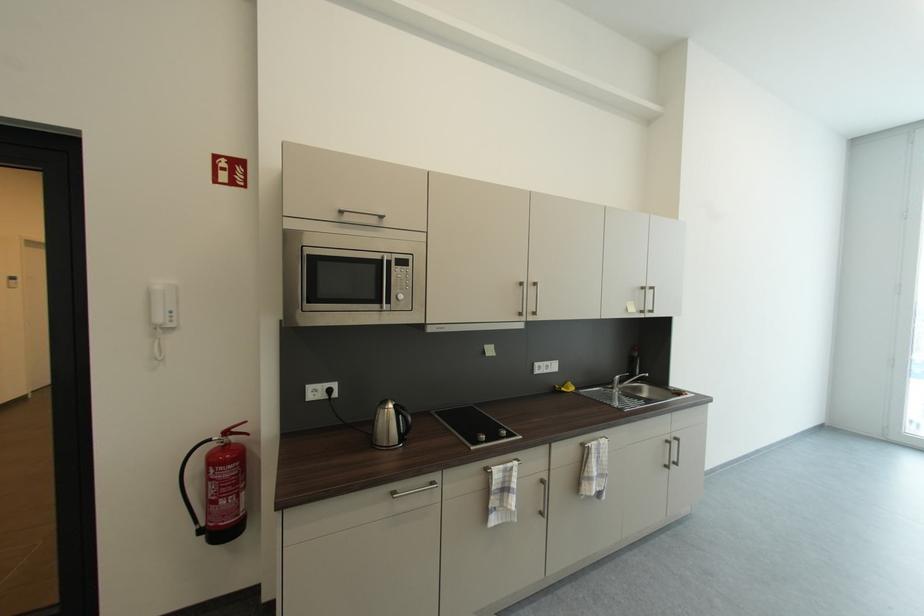
Find the location of a particular element. kettle handle is located at coordinates (403, 419).